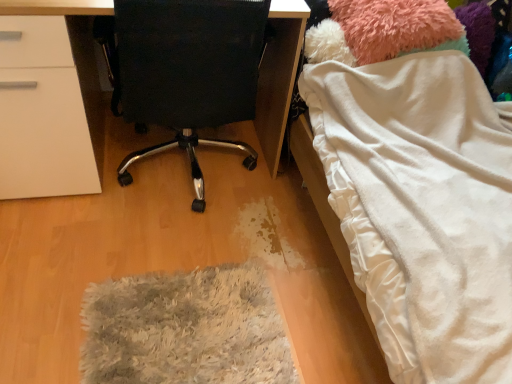
Question: Can you confirm if white soft blanket at right is wider than black fabric chair at center?

Choices:
 (A) yes
 (B) no

Answer: (A)

Question: Is white soft blanket at right taller than black fabric chair at center?

Choices:
 (A) yes
 (B) no

Answer: (B)

Question: Are white soft blanket at right and black fabric chair at center far apart?

Choices:
 (A) yes
 (B) no

Answer: (B)

Question: Is white soft blanket at right in front of black fabric chair at center?

Choices:
 (A) no
 (B) yes

Answer: (B)

Question: Could black fabric chair at center be considered to be inside white soft blanket at right?

Choices:
 (A) no
 (B) yes

Answer: (A)

Question: Does white soft blanket at right turn towards black fabric chair at center?

Choices:
 (A) no
 (B) yes

Answer: (A)

Question: Is white soft blanket at right aimed at fuzzy pink teddy at upper right?

Choices:
 (A) no
 (B) yes

Answer: (A)

Question: Is white soft blanket at right looking in the opposite direction of fuzzy pink teddy at upper right?

Choices:
 (A) no
 (B) yes

Answer: (B)

Question: Is fuzzy pink teddy at upper right a part of white soft blanket at right?

Choices:
 (A) yes
 (B) no

Answer: (A)

Question: Is white soft blanket at right not close to fuzzy pink teddy at upper right?

Choices:
 (A) no
 (B) yes

Answer: (A)

Question: Can you confirm if white soft blanket at right is shorter than fuzzy pink teddy at upper right?

Choices:
 (A) yes
 (B) no

Answer: (B)

Question: From a real-world perspective, is white soft blanket at right below fuzzy pink teddy at upper right?

Choices:
 (A) yes
 (B) no

Answer: (A)

Question: Is gray shaggy rug at lower center further to camera compared to fuzzy pink teddy at upper right?

Choices:
 (A) no
 (B) yes

Answer: (A)